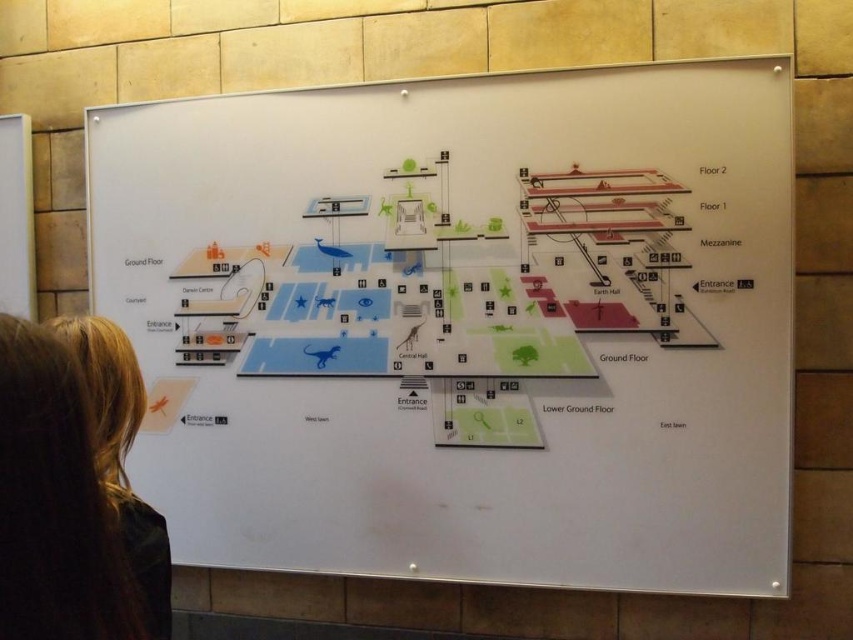
You are standing in front of the whiteboard and notice the white paper map at upper center and the blonde hair at lower left. Which object is taller?

The white paper map at upper center is taller than the blonde hair at lower left.

You are standing in front of the whiteboard displaying the museum floor plan. You see a point labeled as point (463,323). What does this point represent on the floor plan?

The point labeled (463,323) corresponds to the white paper map at upper center.